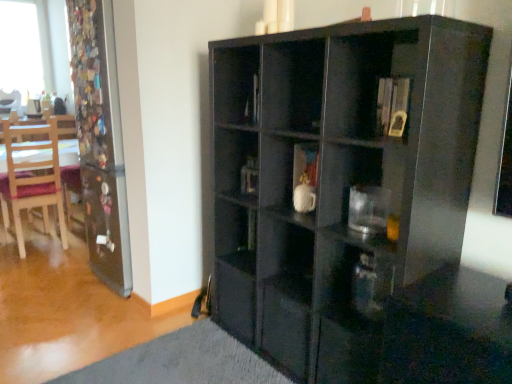
Question: Looking at the image, does wooden chair at left, which is the second chair in left-to-right order, seem bigger or smaller compared to transparent glass coffee cup at center-right?

Choices:
 (A) small
 (B) big

Answer: (B)

Question: Is wooden chair at left, the 1th chair from the bottom, to the left or to the right of transparent glass coffee cup at center-right in the image?

Choices:
 (A) right
 (B) left

Answer: (B)

Question: Estimate the real-world distances between objects in this image. Which object is closer to the transparent glass window at upper left?

Choices:
 (A) glossy black cabinet at center
 (B) wooden chair at left, which ranks as the 1th chair in top-to-bottom order
 (C) wooden chair at left, which is the second chair in left-to-right order
 (D) transparent glass screen door at left
 (E) transparent glass coffee cup at center-right

Answer: (B)

Question: Estimate the real-world distances between objects in this image. Which object is farther from the transparent glass coffee cup at center-right?

Choices:
 (A) wooden chair at left, which ranks as the 1th chair in top-to-bottom order
 (B) transparent glass window at upper left
 (C) transparent glass screen door at left
 (D) glossy black cabinet at center
 (E) wooden chair at left, the 1th chair positioned from the right

Answer: (B)